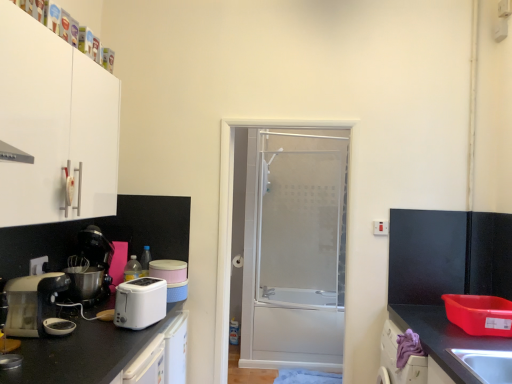
Question: Does matte white toaster at left touch white matte cabinet at upper left?

Choices:
 (A) no
 (B) yes

Answer: (A)

Question: Considering the relative sizes of matte white toaster at left and white matte cabinet at upper left in the image provided, is matte white toaster at left taller than white matte cabinet at upper left?

Choices:
 (A) no
 (B) yes

Answer: (A)

Question: From a real-world perspective, does matte white toaster at left stand above white matte cabinet at upper left?

Choices:
 (A) no
 (B) yes

Answer: (A)

Question: From the image's perspective, does matte white toaster at left appear higher than white matte cabinet at upper left?

Choices:
 (A) no
 (B) yes

Answer: (A)

Question: Does matte white toaster at left have a lesser height compared to white matte cabinet at upper left?

Choices:
 (A) yes
 (B) no

Answer: (A)

Question: Does matte white toaster at left appear on the right side of white matte cabinet at upper left?

Choices:
 (A) no
 (B) yes

Answer: (A)

Question: From the image's perspective, would you say black plastic coffee machine at left is shown under white plastic electric outlet at lower left?

Choices:
 (A) yes
 (B) no

Answer: (A)

Question: Is black plastic coffee machine at left to the left of white plastic electric outlet at lower left from the viewer's perspective?

Choices:
 (A) no
 (B) yes

Answer: (A)

Question: Is black plastic coffee machine at left closer to camera compared to white plastic electric outlet at lower left?

Choices:
 (A) no
 (B) yes

Answer: (A)

Question: Is black plastic coffee machine at left far from white plastic electric outlet at lower left?

Choices:
 (A) no
 (B) yes

Answer: (A)

Question: Is black plastic coffee machine at left not within white plastic electric outlet at lower left?

Choices:
 (A) no
 (B) yes

Answer: (B)

Question: Considering the relative sizes of black plastic coffee machine at left and white plastic electric outlet at lower left in the image provided, is black plastic coffee machine at left thinner than white plastic electric outlet at lower left?

Choices:
 (A) no
 (B) yes

Answer: (A)

Question: From the image's perspective, is purple fabric at lower right below black granite countertop at lower right, arranged as the 2th countertop when viewed from the left?

Choices:
 (A) yes
 (B) no

Answer: (B)